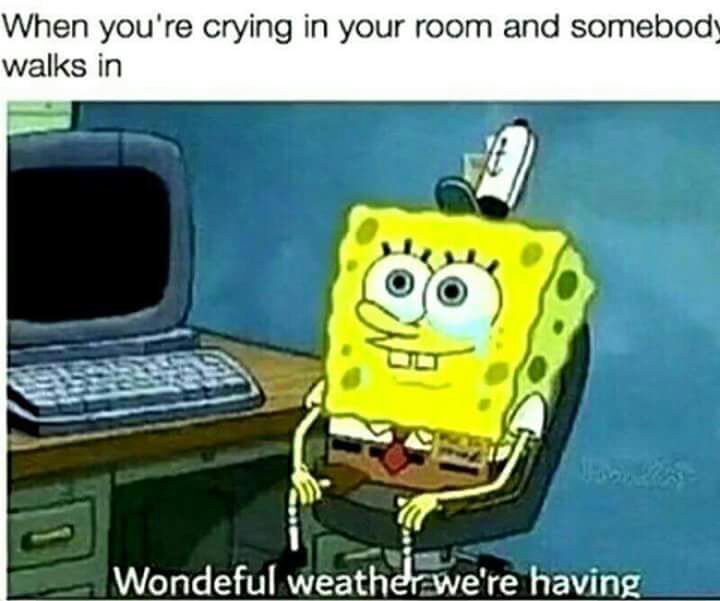
Where is `desk`? desk is located at coordinates (288, 391).